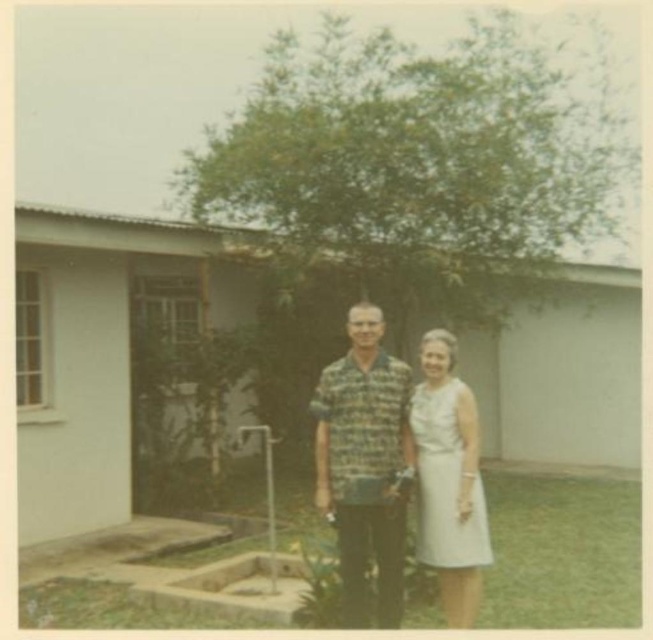
Is printed cotton shirt at center closer to camera compared to white satin dress at center?

Yes, printed cotton shirt at center is in front of white satin dress at center.

Is point (326, 422) positioned after point (458, 477)?

No, (326, 422) is in front of (458, 477).

Is point (374, 349) farther from viewer compared to point (475, 426)?

No, (374, 349) is in front of (475, 426).

Image resolution: width=653 pixels, height=640 pixels. I want to click on printed cotton shirt at center, so click(364, 464).